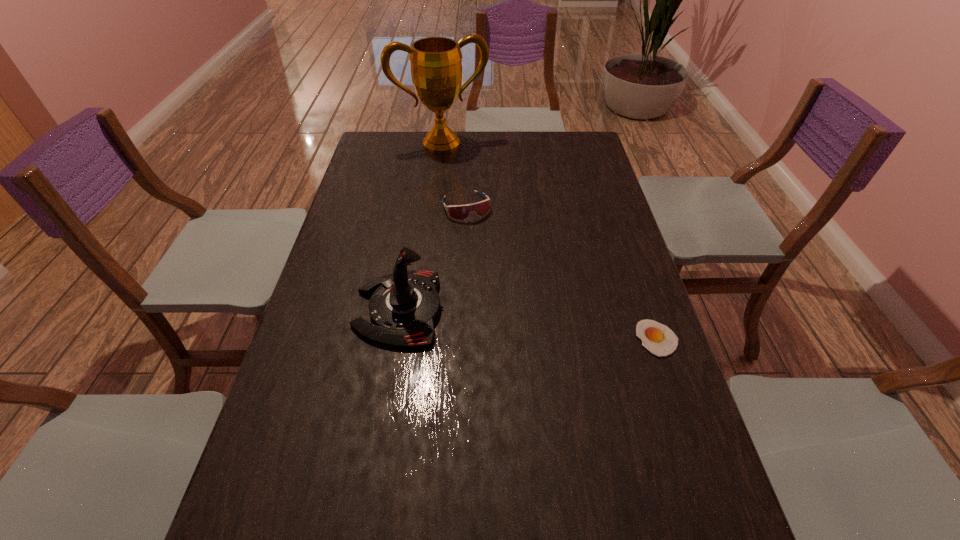
Image resolution: width=960 pixels, height=540 pixels. Identify the location of free spot between the second shortest object and the joystick. (433, 258).

Identify the location of free spot between the egg yolk and the third tallest object. The width and height of the screenshot is (960, 540). (562, 273).

Locate an element on the screen. free space between the tallest object and the joystick is located at coordinates (420, 227).

Locate an element on the screen. free space between the egg yolk and the joystick is located at coordinates (528, 324).

Identify which object is the second nearest to the third tallest object. Please provide its 2D coordinates. Your answer should be formatted as a tuple, i.e. [(x, y)], where the tuple contains the x and y coordinates of a point satisfying the conditions above.

[(436, 67)]

Select which object is the second closest to the goggles. Please provide its 2D coordinates. Your answer should be formatted as a tuple, i.e. [(x, y)], where the tuple contains the x and y coordinates of a point satisfying the conditions above.

[(436, 67)]